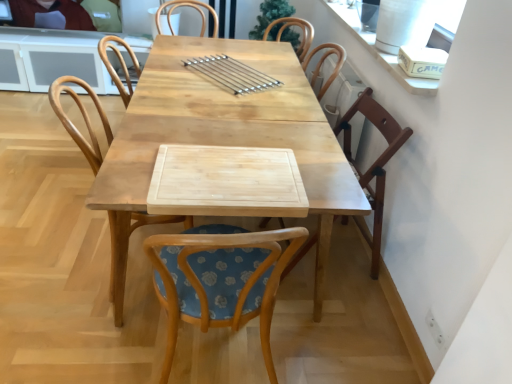
This screenshot has width=512, height=384. I want to click on free region on the left part of wooden chair at center, which is counted as the first chair, starting from the left, so click(x=53, y=258).